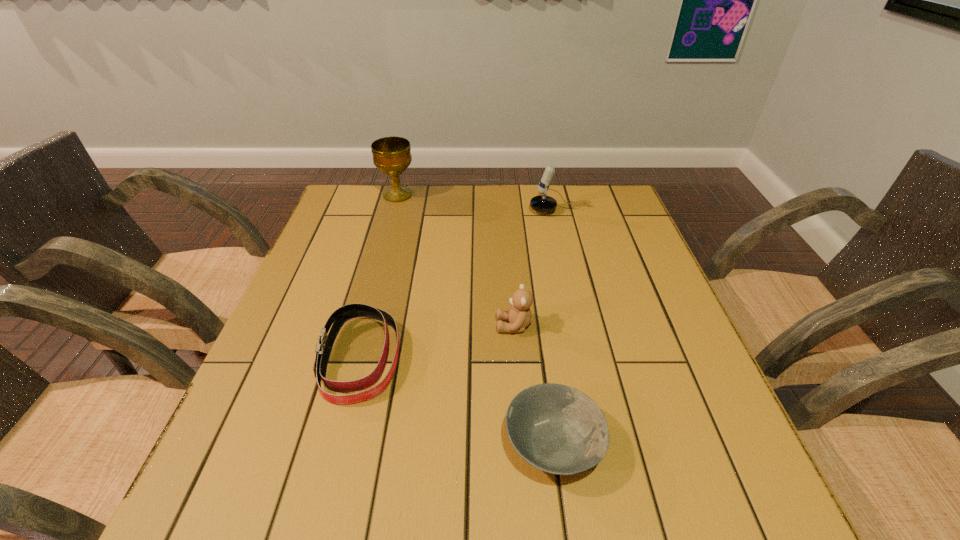
Where is `vacant area situated on the left of the dog collar`? vacant area situated on the left of the dog collar is located at coordinates point(267,359).

Where is `vacant space situated 0.370m on the left of the shortest object`? vacant space situated 0.370m on the left of the shortest object is located at coordinates (291, 444).

Locate an element on the screen. This screenshot has height=540, width=960. chalice at the far edge is located at coordinates (392, 155).

What are the coordinates of `microphone that is at the far edge` in the screenshot? It's located at (542, 203).

Image resolution: width=960 pixels, height=540 pixels. I want to click on object located at the near edge, so click(557, 429).

This screenshot has height=540, width=960. Find the location of `chalice that is at the left edge`. chalice that is at the left edge is located at coordinates (392, 155).

Locate an element on the screen. The height and width of the screenshot is (540, 960). dog collar that is positioned at the left edge is located at coordinates click(x=341, y=315).

Where is `object situated at the right edge`? The image size is (960, 540). object situated at the right edge is located at coordinates (542, 203).

Where is `object present at the far left corner`? The width and height of the screenshot is (960, 540). object present at the far left corner is located at coordinates (392, 155).

Find the location of `object located in the far right corner section of the desktop`. object located in the far right corner section of the desktop is located at coordinates (542, 203).